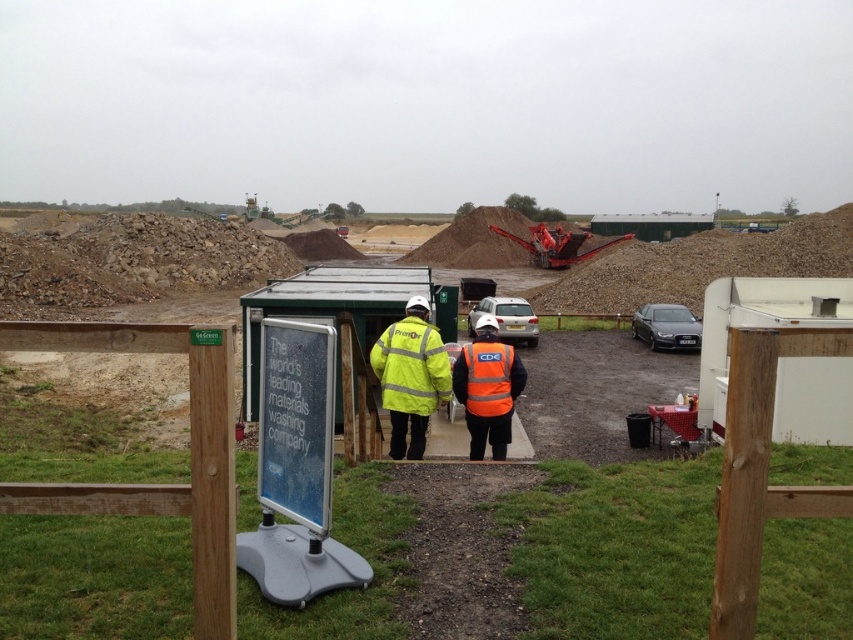
Question: Is orange reflective vest at center to the right of orange reflective safety vest at center from the viewer's perspective?

Choices:
 (A) no
 (B) yes

Answer: (B)

Question: Does reflective yellow vest at center appear on the left side of metallic red machinery at center?

Choices:
 (A) no
 (B) yes

Answer: (B)

Question: Which object is farther from the camera taking this photo?

Choices:
 (A) metallic red machinery at center
 (B) orange reflective vest at center
 (C) high-visibility yellow jacket at center

Answer: (A)

Question: Which object is farther from the camera taking this photo?

Choices:
 (A) high-visibility yellow jacket at center
 (B) reflective yellow vest at center
 (C) orange reflective safety vest at center
 (D) orange reflective vest at center

Answer: (C)

Question: Can you confirm if high-visibility yellow jacket at center is thinner than orange reflective safety vest at center?

Choices:
 (A) yes
 (B) no

Answer: (B)

Question: Which object appears farthest from the camera in this image?

Choices:
 (A) high-visibility yellow jacket at center
 (B) metallic red machinery at center

Answer: (B)